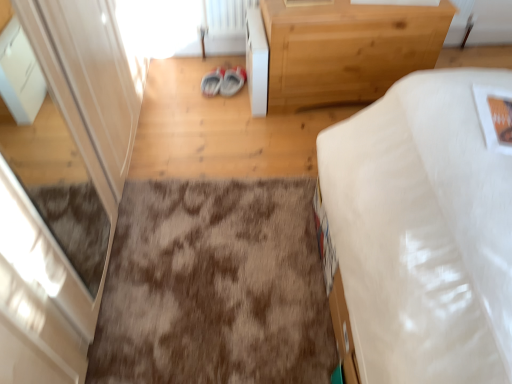
Locate an element on the screen. The image size is (512, 384). vacant area that lies between white glossy screen door at left and brown shaggy rug at center is located at coordinates (197, 133).